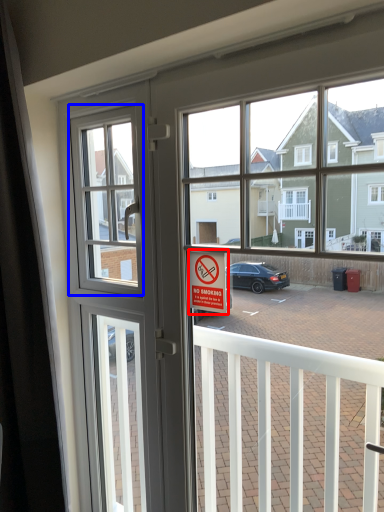
Question: Which object appears farthest to the camera in this image, parking sign (highlighted by a red box) or window screen (highlighted by a blue box)?

Choices:
 (A) parking sign
 (B) window screen

Answer: (B)